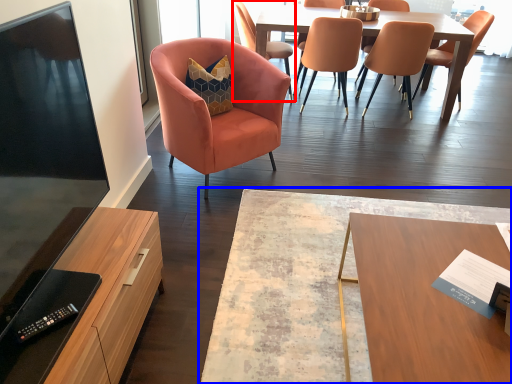
Question: Which point is further to the camera, chair (highlighted by a red box) or coffee table (highlighted by a blue box)?

Choices:
 (A) chair
 (B) coffee table

Answer: (A)